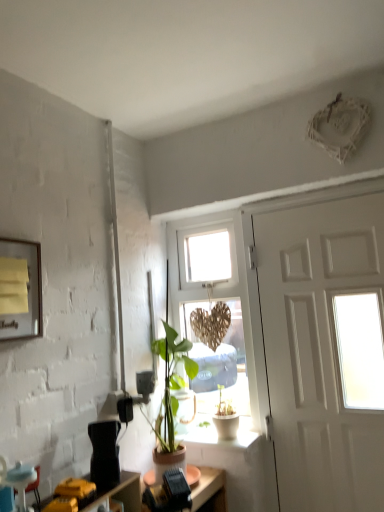
Question: From the image's perspective, does yellow paper at upper left appear higher than blue fabric armchair at lower left?

Choices:
 (A) no
 (B) yes

Answer: (B)

Question: Are yellow paper at upper left and blue fabric armchair at lower left beside each other?

Choices:
 (A) no
 (B) yes

Answer: (A)

Question: Is yellow paper at upper left aimed at blue fabric armchair at lower left?

Choices:
 (A) no
 (B) yes

Answer: (A)

Question: Considering the relative positions of yellow paper at upper left and blue fabric armchair at lower left in the image provided, is yellow paper at upper left to the left of blue fabric armchair at lower left from the viewer's perspective?

Choices:
 (A) yes
 (B) no

Answer: (A)

Question: From a real-world perspective, is yellow paper at upper left below blue fabric armchair at lower left?

Choices:
 (A) no
 (B) yes

Answer: (A)

Question: From a real-world perspective, is wooden heart at center positioned above or below white matte door at right?

Choices:
 (A) above
 (B) below

Answer: (A)

Question: Does point (254, 335) appear closer or farther from the camera than point (276, 451)?

Choices:
 (A) farther
 (B) closer

Answer: (A)

Question: Considering the positions of wooden heart at center and white matte door at right in the image, is wooden heart at center bigger or smaller than white matte door at right?

Choices:
 (A) big
 (B) small

Answer: (B)

Question: Considering the relative positions of wooden heart at center and white matte door at right in the image provided, is wooden heart at center to the left or to the right of white matte door at right?

Choices:
 (A) left
 (B) right

Answer: (A)

Question: Visually, is wooden heart at center positioned to the left or to the right of white ceramic pot at lower center?

Choices:
 (A) right
 (B) left

Answer: (A)

Question: Considering the positions of wooden heart at center and white ceramic pot at lower center in the image, is wooden heart at center wider or thinner than white ceramic pot at lower center?

Choices:
 (A) wide
 (B) thin

Answer: (B)

Question: Looking at the image, does wooden heart at center seem bigger or smaller compared to white ceramic pot at lower center?

Choices:
 (A) big
 (B) small

Answer: (A)

Question: From a real-world perspective, is wooden heart at center physically located above or below white ceramic pot at lower center?

Choices:
 (A) below
 (B) above

Answer: (B)

Question: Based on their sizes in the image, would you say white matte door at right is bigger or smaller than blue fabric armchair at lower left?

Choices:
 (A) small
 (B) big

Answer: (B)

Question: Is white matte door at right taller or shorter than blue fabric armchair at lower left?

Choices:
 (A) tall
 (B) short

Answer: (A)